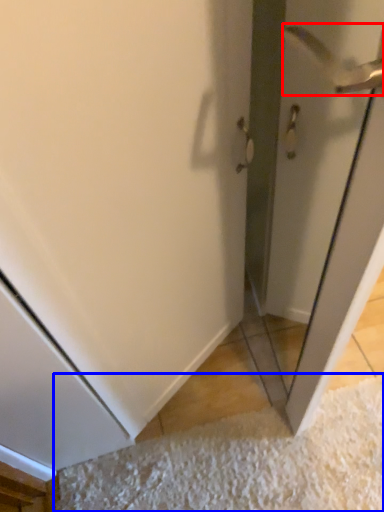
Question: Which point is further to the camera, door handle (highlighted by a red box) or doormat (highlighted by a blue box)?

Choices:
 (A) door handle
 (B) doormat

Answer: (A)